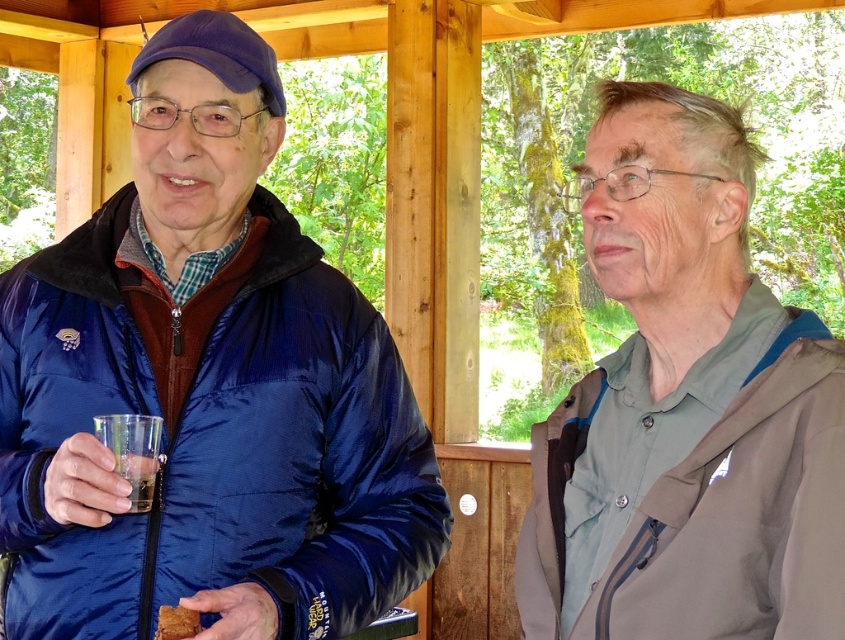
You are a photographer wanting to capture a closeup of the brown crumbly bread at lower left without including the clear plastic cup at left in the frame. Based on their positions, can you position yourself in a way to achieve this?

The clear plastic cup at left is positioned on the left side of brown crumbly bread at lower left. To avoid including the clear plastic cup at left in the frame, position yourself to the right side of the brown crumbly bread at lower left so that the cup is out of the shot.

You are planning to place both the clear plastic cup at left and the brown crumbly bread at lower left on a small tray that can only hold items up to the size of the cup. Which item should you place first to ensure both fit?

Since the clear plastic cup at left is bigger than the brown crumbly bread at lower left, you should place the clear plastic cup at left first to make sure there is enough space for the smaller brown crumbly bread at lower left.

You are trying to find the blue quilted jacket at center and the gray matte jacket at right in the image. According to their positions, which one is closer to the left side of the image?

The blue quilted jacket at center is to the left of the gray matte jacket at right, so the blue quilted jacket at center is closer to the left side of the image.